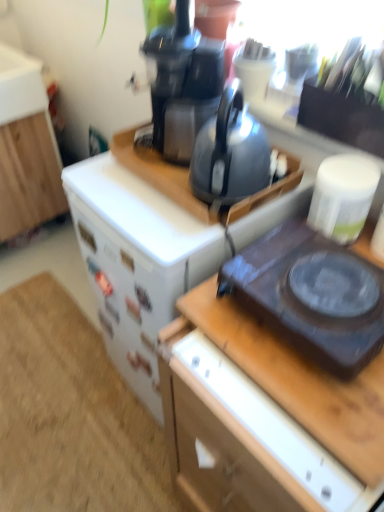
Question: From their relative heights in the image, would you say white wood cabinet at left is taller or shorter than black plastic coffee pot at upper center?

Choices:
 (A) tall
 (B) short

Answer: (A)

Question: Based on their positions, is white wood cabinet at left located to the left or right of black plastic coffee pot at upper center?

Choices:
 (A) right
 (B) left

Answer: (B)

Question: Based on their relative distances, which object is farther from the black plastic coffee pot at upper center?

Choices:
 (A) white wood cabinet at left
 (B) matte black kettle at center
 (C) wooden desk at center
 (D) black plastic gas stove at right

Answer: (A)

Question: Estimate the real-world distances between objects in this image. Which object is farther from the black plastic gas stove at right?

Choices:
 (A) black plastic coffee pot at upper center
 (B) white wood cabinet at left
 (C) wooden desk at center
 (D) matte black kettle at center

Answer: (B)